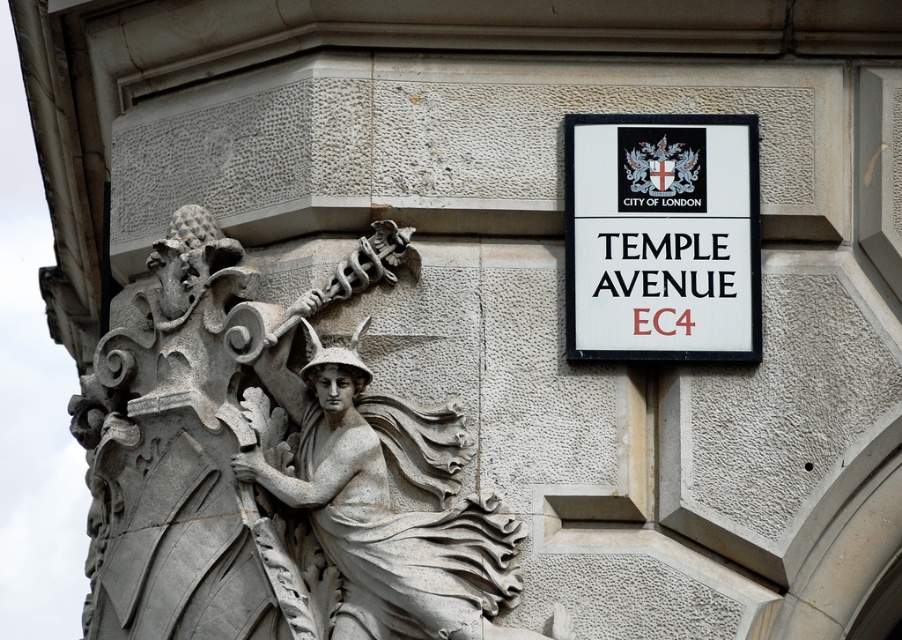
Who is higher up, white plastic sign at upper center or white stone angel at center?

white plastic sign at upper center is higher up.

You are a GUI agent. You are given a task and a screenshot of the screen. Output one action in this format:
    pyautogui.click(x=<x>, y=<y>)
    Task: Click on the white plastic sign at upper center
    
    Given the screenshot: What is the action you would take?
    pyautogui.click(x=661, y=237)

Which of these two, white stone sculpture at upper left or white stone angel at center, stands shorter?

white stone angel at center is shorter.

Is point (334, 445) farther from camera compared to point (336, 515)?

Yes, it is behind point (336, 515).

Where is `white stone sculpture at upper left`? white stone sculpture at upper left is located at coordinates (275, 467).

Is white stone sculpture at upper left bigger than white plastic sign at upper center?

Yes, white stone sculpture at upper left is bigger than white plastic sign at upper center.

Which is in front, point (155, 448) or point (714, 193)?

Point (155, 448)

Is point (382, 433) less distant than point (721, 179)?

Yes, it is.

Locate an element on the screen. white stone sculpture at upper left is located at coordinates (275, 467).